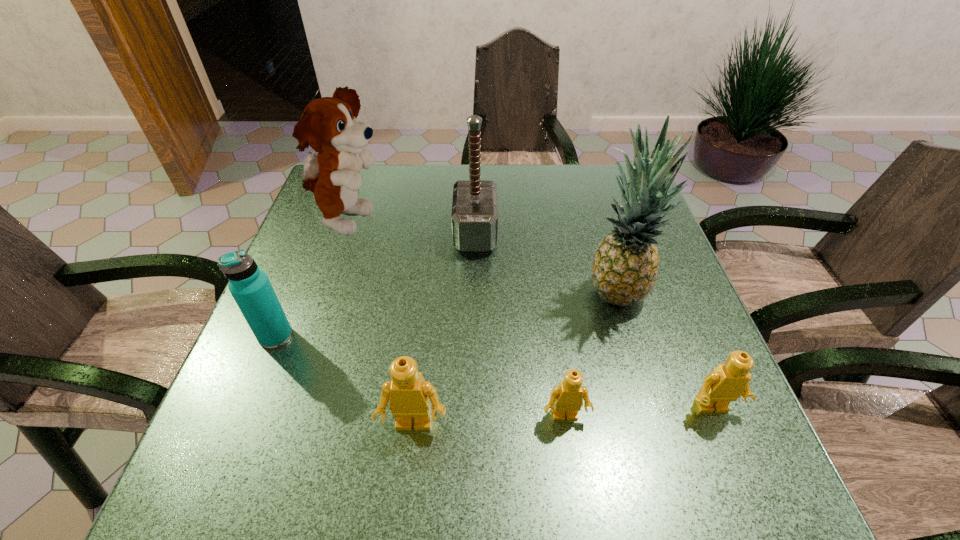
Identify the location of object situated at the near right corner. (727, 382).

In the image, there is a desktop. Where is `free space at the far edge`? The height and width of the screenshot is (540, 960). free space at the far edge is located at coordinates (425, 202).

Locate an element on the screen. The width and height of the screenshot is (960, 540). free space at the near edge is located at coordinates pyautogui.click(x=354, y=416).

Where is `vacant space at the left edge of the desktop`? vacant space at the left edge of the desktop is located at coordinates (282, 285).

Find the location of `free space at the right edge of the desktop`. free space at the right edge of the desktop is located at coordinates (642, 367).

At what (x,y) coordinates should I click in order to perform the action: click on vacant space at the far left corner. Please return your answer as a coordinate pair (x, y). The image size is (960, 540). Looking at the image, I should click on (314, 208).

The image size is (960, 540). What are the coordinates of `vacant space at the far right corner of the desktop` in the screenshot? It's located at (599, 201).

This screenshot has height=540, width=960. What are the coordinates of `vacant area between the hammer and the third farthest object` in the screenshot? It's located at (545, 262).

Identify the location of vacant space that's between the puppy and the shortest object. point(457,319).

At what (x,y) coordinates should I click in order to perform the action: click on vacant area that lies between the second shortest Lego and the puppy. Please return your answer as a coordinate pair (x, y). This screenshot has width=960, height=540. Looking at the image, I should click on coord(530,315).